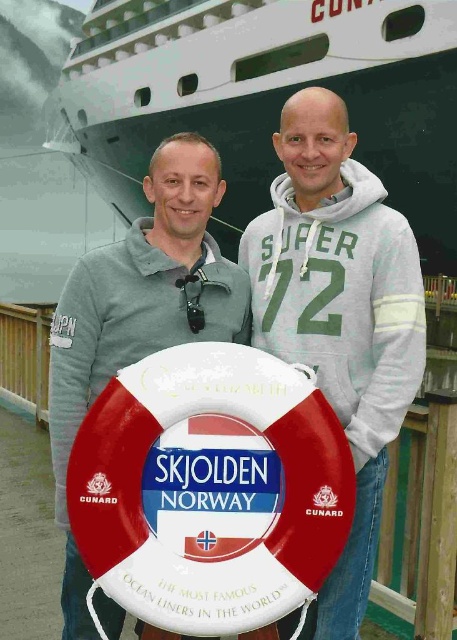
Looking at this image, you are a photographer trying to capture a photo of the two people and the cruise ship. The white matte life preserver at center is an important element in the composition. Where should you position the life preserver relative to the two people and the cruise ship to maintain a balanced composition?

The white matte life preserver at center is positioned at point 0.489 on the horizontal axis and 0.744 on the vertical axis, which places it slightly to the right and lower than the center of the image. To maintain balance, ensure it aligns with the rule of thirds by placing it near the intersection points of the grid, keeping it between the two people and the cruise ship in the background.

Based on the photo, you are a photographer trying to capture a closeup of the white matte life preserver at center and the matte gray hoodie at center. Since you want to focus on the life preserver, which object should you move closer to the camera to ensure it appears larger in the photo?

A: The white matte life preserver at center is already larger than the matte gray hoodie at center, so to make it appear even larger in the photo, you should move the white matte life preserver at center closer to the camera.

Based on the photo, you are a photographer trying to capture both the white plastic lifebuoy at center and the white matte life preserver at center in a single frame. Since they are both at the center, how can you position your camera to ensure both objects are clearly visible in the photo?

Since the white plastic lifebuoy at center has a smaller width than the white matte life preserver at center, position the camera slightly closer to the white plastic lifebuoy at center to balance their sizes in the frame.